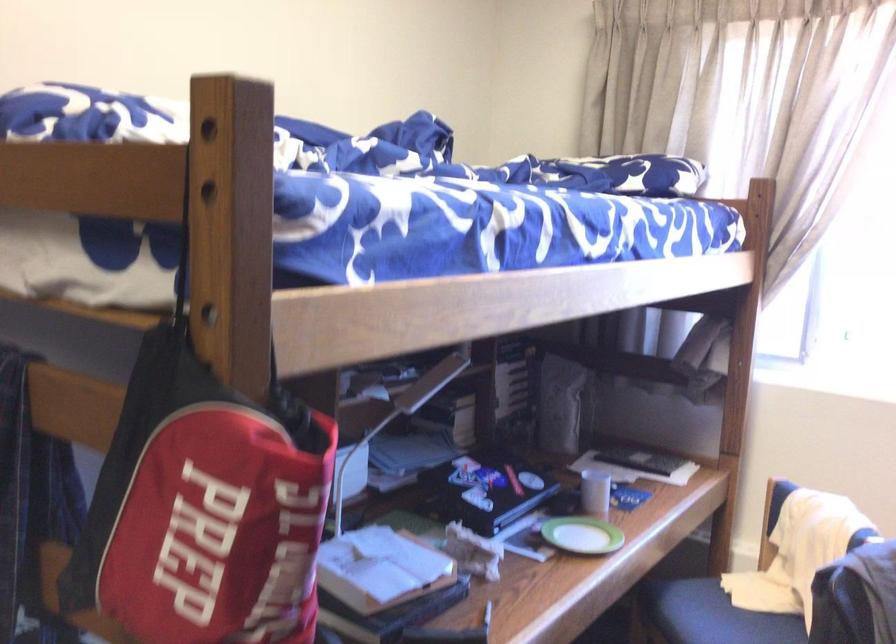
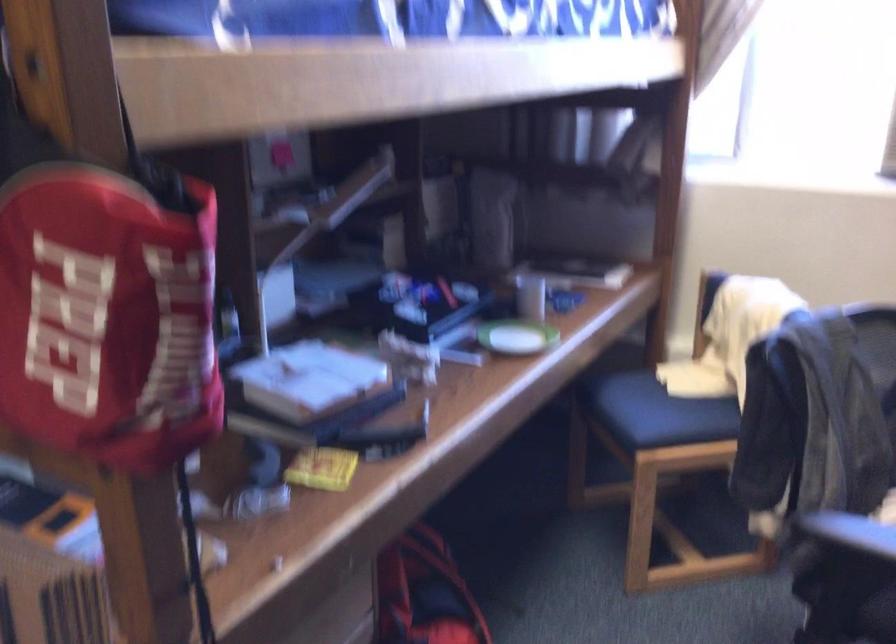
Question: How did the camera likely rotate?

Choices:
 (A) Left
 (B) Right
 (C) Up
 (D) Down

Answer: (D)